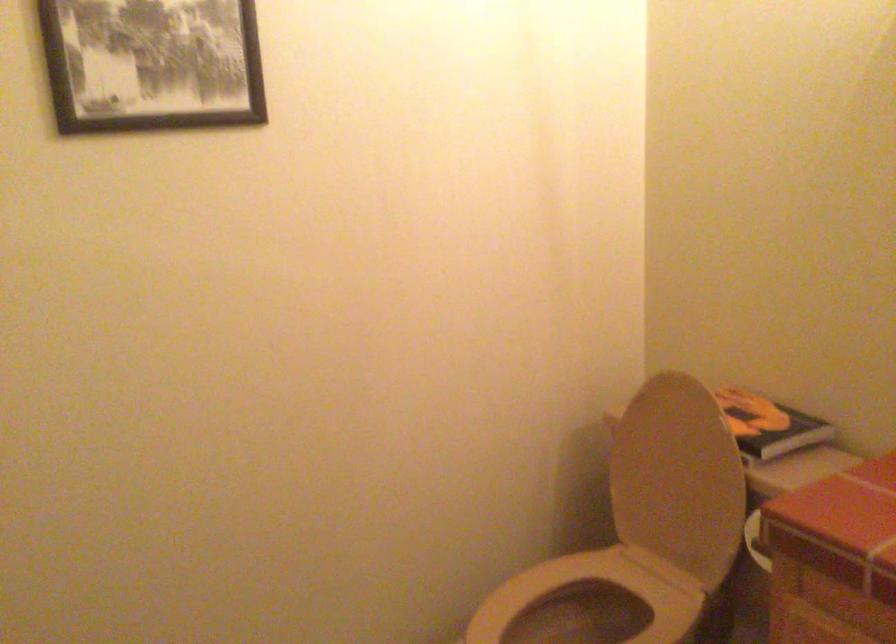
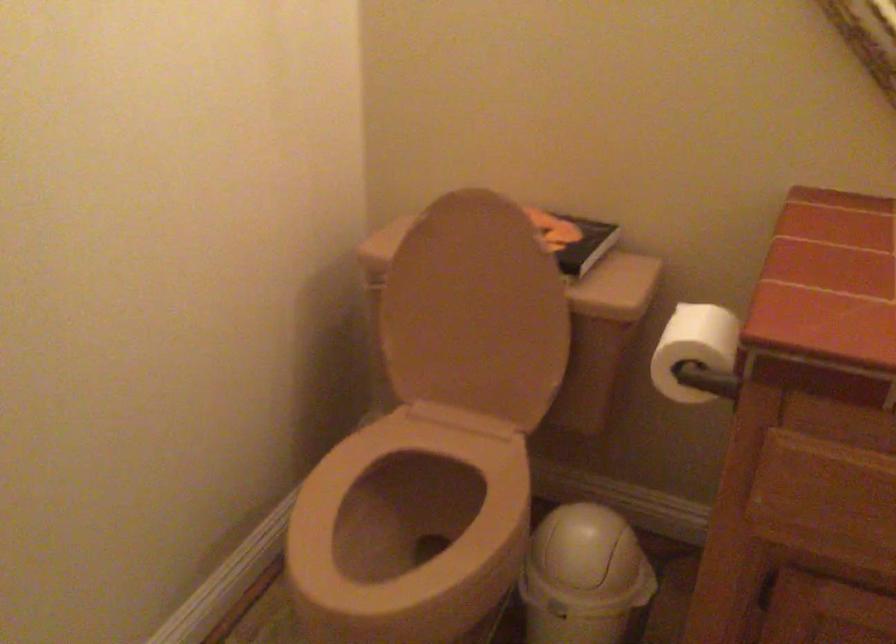
Question: The camera is either moving clockwise (left) or counter-clockwise (right) around the object. The first image is from the beginning of the video and the second image is from the end. Is the camera moving left or right when shooting the video?

Choices:
 (A) Left
 (B) Right

Answer: (A)